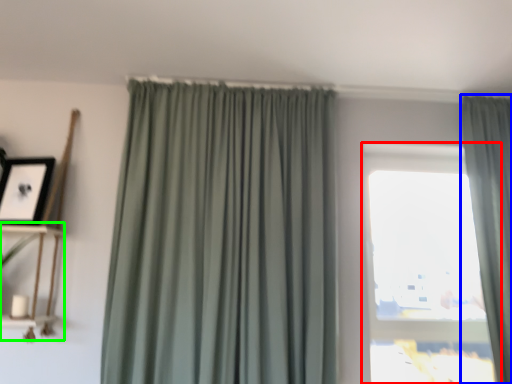
Question: Considering the real-world distances, which object is farthest from window (highlighted by a red box)? curtain (highlighted by a blue box) or shelf (highlighted by a green box)?

Choices:
 (A) curtain
 (B) shelf

Answer: (B)